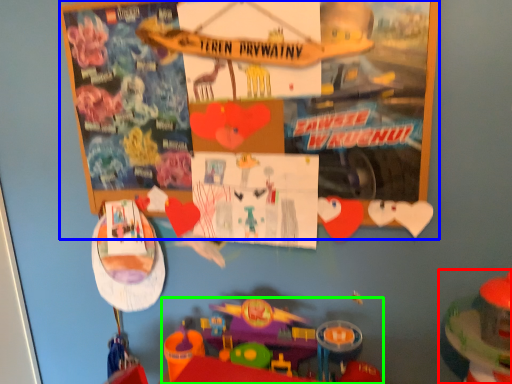
Question: Which is farther away from toy (highlighted by a red box)? bulletin board (highlighted by a blue box) or toy (highlighted by a green box)?

Choices:
 (A) bulletin board
 (B) toy

Answer: (A)